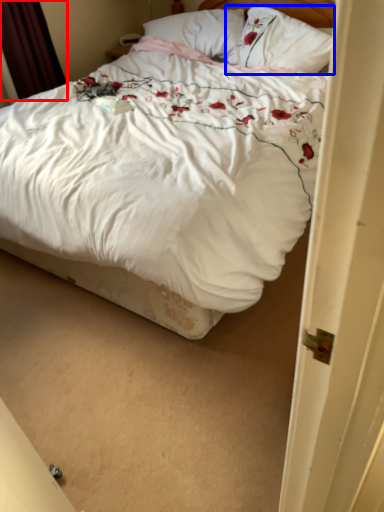
Question: Which point is further to the camera, curtain (highlighted by a red box) or pillow (highlighted by a blue box)?

Choices:
 (A) curtain
 (B) pillow

Answer: (A)